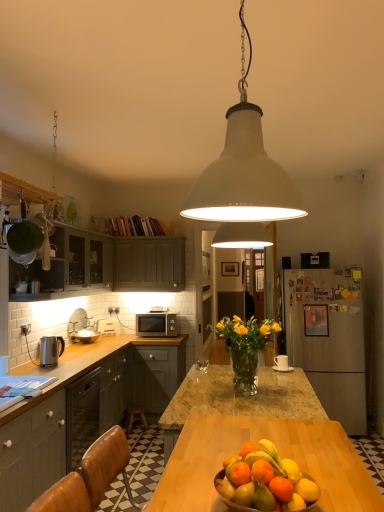
Question: Is orange matte fruit at center surrounding matte gray cabinets at upper left, the fourth cabinetry positioned from the bottom?

Choices:
 (A) no
 (B) yes

Answer: (A)

Question: Considering the relative sizes of orange matte fruit at center and matte gray cabinets at upper left, the fourth cabinetry positioned from the bottom, in the image provided, is orange matte fruit at center wider than matte gray cabinets at upper left, the fourth cabinetry positioned from the bottom,?

Choices:
 (A) yes
 (B) no

Answer: (B)

Question: Is orange matte fruit at center positioned beyond the bounds of matte gray cabinets at upper left, the first cabinetry in the top-to-bottom sequence?

Choices:
 (A) yes
 (B) no

Answer: (A)

Question: Would you consider orange matte fruit at center to be distant from matte gray cabinets at upper left, the first cabinetry in the top-to-bottom sequence?

Choices:
 (A) yes
 (B) no

Answer: (A)

Question: Is orange matte fruit at center thinner than matte gray cabinets at upper left, the fourth cabinetry positioned from the bottom?

Choices:
 (A) no
 (B) yes

Answer: (B)

Question: Considering their positions, is polished stainless steel kettle at left, placed as the second appliance when sorted from back to front, located in front of or behind orange matte fruit at center?

Choices:
 (A) behind
 (B) front

Answer: (A)

Question: Considering the positions of polished stainless steel kettle at left, acting as the first appliance starting from the front, and orange matte fruit at center in the image, is polished stainless steel kettle at left, acting as the first appliance starting from the front, wider or thinner than orange matte fruit at center?

Choices:
 (A) thin
 (B) wide

Answer: (A)

Question: Is polished stainless steel kettle at left, placed as the second appliance when sorted from back to front, inside the boundaries of orange matte fruit at center, or outside?

Choices:
 (A) outside
 (B) inside

Answer: (A)

Question: Considering the positions of polished stainless steel kettle at left, placed as the second appliance when sorted from back to front, and orange matte fruit at center in the image, is polished stainless steel kettle at left, placed as the second appliance when sorted from back to front, taller or shorter than orange matte fruit at center?

Choices:
 (A) tall
 (B) short

Answer: (A)

Question: Relative to satin silver microwave at center, is matte gray cabinets at left, the fourth cabinetry positioned from the top, in front or behind?

Choices:
 (A) front
 (B) behind

Answer: (A)

Question: Looking at the image, does matte gray cabinets at left, which is the first cabinetry in bottom-to-top order, seem bigger or smaller compared to satin silver microwave at center?

Choices:
 (A) big
 (B) small

Answer: (A)

Question: From the image's perspective, is matte gray cabinets at left, the fourth cabinetry positioned from the top, located above or below satin silver microwave at center?

Choices:
 (A) below
 (B) above

Answer: (A)

Question: Is matte gray cabinets at left, the fourth cabinetry positioned from the top, spatially inside satin silver microwave at center, or outside of it?

Choices:
 (A) inside
 (B) outside

Answer: (B)

Question: From the image's perspective, relative to matte gray cabinets at upper left, the first cabinetry in the top-to-bottom sequence, is orange matte fruit at center above or below?

Choices:
 (A) above
 (B) below

Answer: (B)

Question: Is point (246, 499) positioned closer to the camera than point (132, 269)?

Choices:
 (A) farther
 (B) closer

Answer: (B)